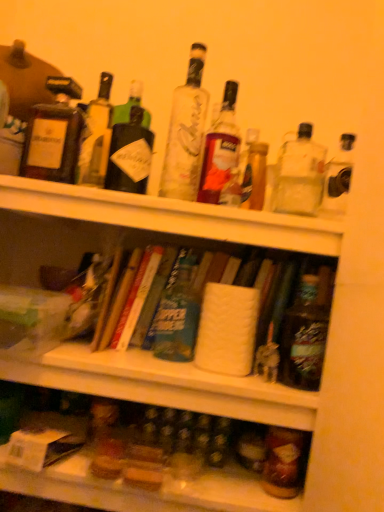
Question: Is hardcover book at center wider or thinner than green glass bottle at upper left, the eighth bottle when ordered from right to left?

Choices:
 (A) thin
 (B) wide

Answer: (B)

Question: From the image's perspective, is hardcover book at center located above or below green glass bottle at upper left, the eighth bottle when ordered from right to left?

Choices:
 (A) above
 (B) below

Answer: (B)

Question: Considering the real-world distances, which object is farthest from the green glass bottle at upper left, the eighth bottle when ordered from right to left?

Choices:
 (A) matte brown bottle at upper left, which is the ninth bottle in right-to-left order
 (B) translucent glass bottle at center, placed as the fifth bottle when sorted from right to left
 (C) clear glass bottle at center, marked as the fourth bottle in a left-to-right arrangement
 (D) blue matte bagel at center, which ranks as the seventh bottle in right-to-left order
 (E) translucent glass bottles at lower center

Answer: (E)

Question: Which object is positioned farthest from the clear glass bottle at upper right, the 8th bottle viewed from the left?

Choices:
 (A) matte brown bottle at upper left, which is the ninth bottle in right-to-left order
 (B) translucent glass bottle at lower right, the third bottle viewed from the right
 (C) green glass bottle at upper left, the eighth bottle when ordered from right to left
 (D) hardcover book at center
 (E) translucent glass bottle at upper center, acting as the fourth bottle starting from the right

Answer: (B)